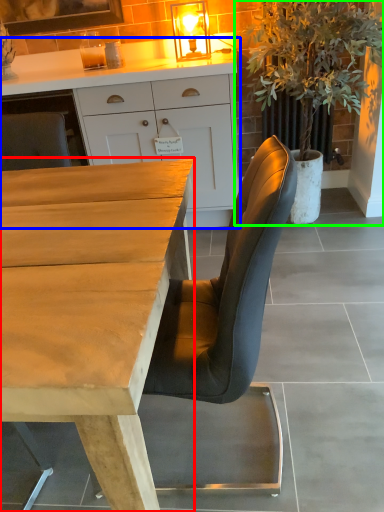
Question: Which object is positioned farthest from desk (highlighted by a red box)? Select from cabinetry (highlighted by a blue box) and houseplant (highlighted by a green box).

Choices:
 (A) cabinetry
 (B) houseplant

Answer: (B)